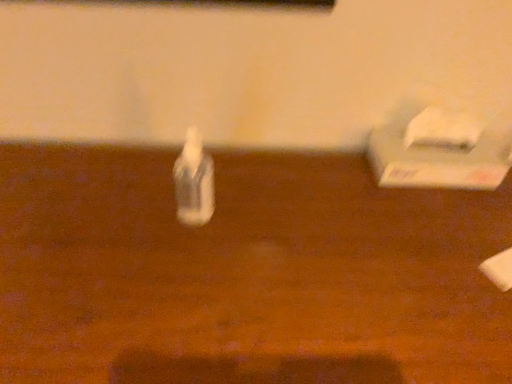
Question: Is wooden table at center shorter than white matte tissue box at right?

Choices:
 (A) no
 (B) yes

Answer: (A)

Question: Does wooden table at center contain white matte tissue box at right?

Choices:
 (A) yes
 (B) no

Answer: (B)

Question: Does wooden table at center appear on the left side of white matte tissue box at right?

Choices:
 (A) yes
 (B) no

Answer: (A)

Question: From a real-world perspective, is wooden table at center below white matte tissue box at right?

Choices:
 (A) no
 (B) yes

Answer: (B)

Question: Considering the relative sizes of wooden table at center and white matte tissue box at right in the image provided, is wooden table at center wider than white matte tissue box at right?

Choices:
 (A) yes
 (B) no

Answer: (A)

Question: Considering the relative sizes of wooden table at center and white matte tissue box at right in the image provided, is wooden table at center smaller than white matte tissue box at right?

Choices:
 (A) yes
 (B) no

Answer: (B)

Question: From the image's perspective, is wooden table at center located beneath transparent plastic bottle at center?

Choices:
 (A) no
 (B) yes

Answer: (B)

Question: From the image's perspective, is wooden table at center on transparent plastic bottle at center?

Choices:
 (A) no
 (B) yes

Answer: (A)

Question: Is wooden table at center thinner than transparent plastic bottle at center?

Choices:
 (A) no
 (B) yes

Answer: (A)

Question: From a real-world perspective, is wooden table at center on transparent plastic bottle at center?

Choices:
 (A) no
 (B) yes

Answer: (A)

Question: Considering the relative sizes of wooden table at center and transparent plastic bottle at center in the image provided, is wooden table at center bigger than transparent plastic bottle at center?

Choices:
 (A) no
 (B) yes

Answer: (B)

Question: Can we say wooden table at center lies outside transparent plastic bottle at center?

Choices:
 (A) no
 (B) yes

Answer: (B)

Question: Are white matte tissue box at right and wooden table at center far apart?

Choices:
 (A) no
 (B) yes

Answer: (A)